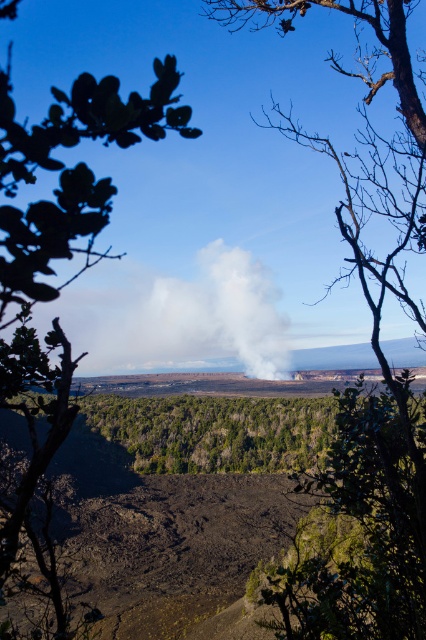
Question: Can you confirm if bare branches at center is wider than green leafy tree at upper left?

Choices:
 (A) yes
 (B) no

Answer: (A)

Question: Observing the image, what is the correct spatial positioning of bare branches at center in reference to green leafy tree at upper left?

Choices:
 (A) left
 (B) right

Answer: (B)

Question: Which point is closer to the camera?

Choices:
 (A) green leafy tree at upper left
 (B) bare branches at center

Answer: (A)

Question: Which point is farther from the camera taking this photo?

Choices:
 (A) (94, 211)
 (B) (362, 64)

Answer: (B)

Question: Among these points, which one is farthest from the camera?

Choices:
 (A) (60, 337)
 (B) (425, 531)

Answer: (B)

Question: Considering the relative positions of bare branches at center and green leafy tree at upper left in the image provided, where is bare branches at center located with respect to green leafy tree at upper left?

Choices:
 (A) left
 (B) right

Answer: (B)